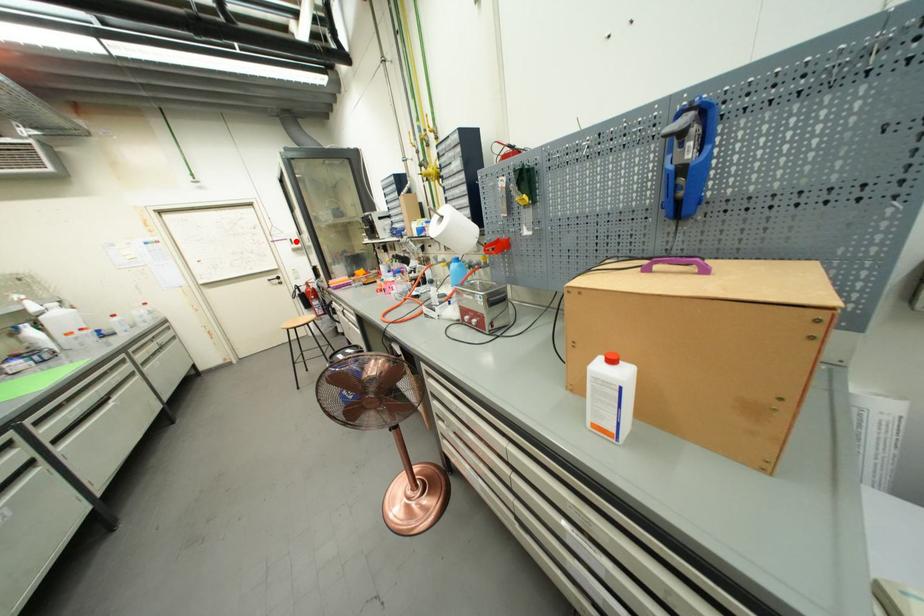
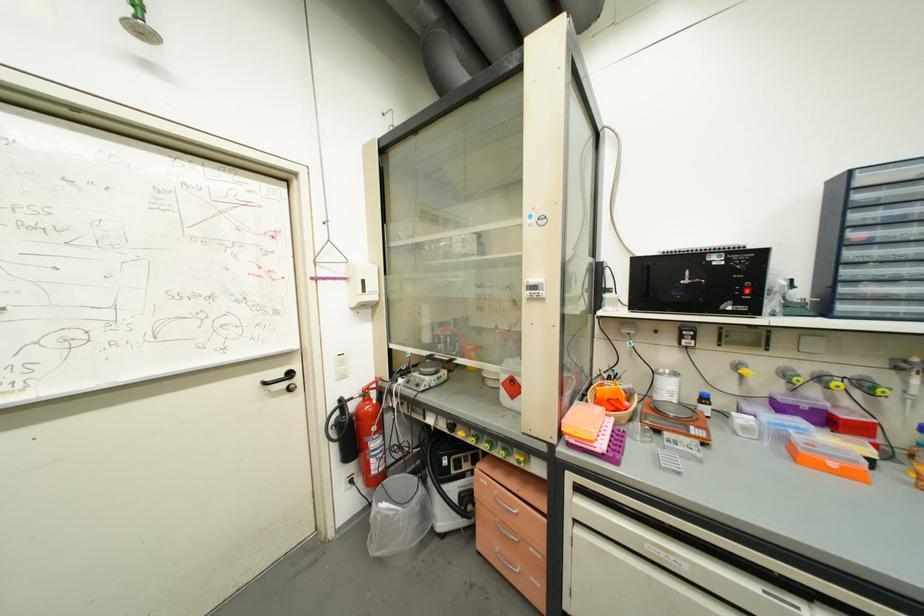
The point at the highlighted location is marked in the first image. Where is the corresponding point in the second image?

(369, 283)